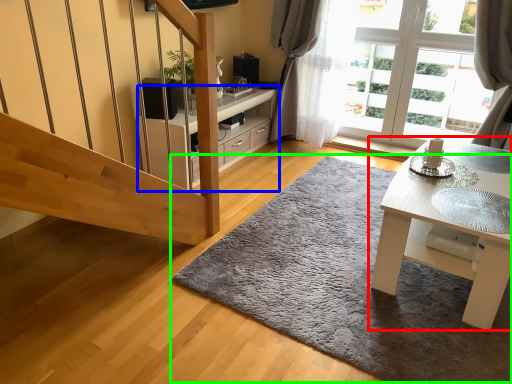
Question: Which is farther away from table (highlighted by a red box)? cabinetry (highlighted by a blue box) or doormat (highlighted by a green box)?

Choices:
 (A) cabinetry
 (B) doormat

Answer: (A)